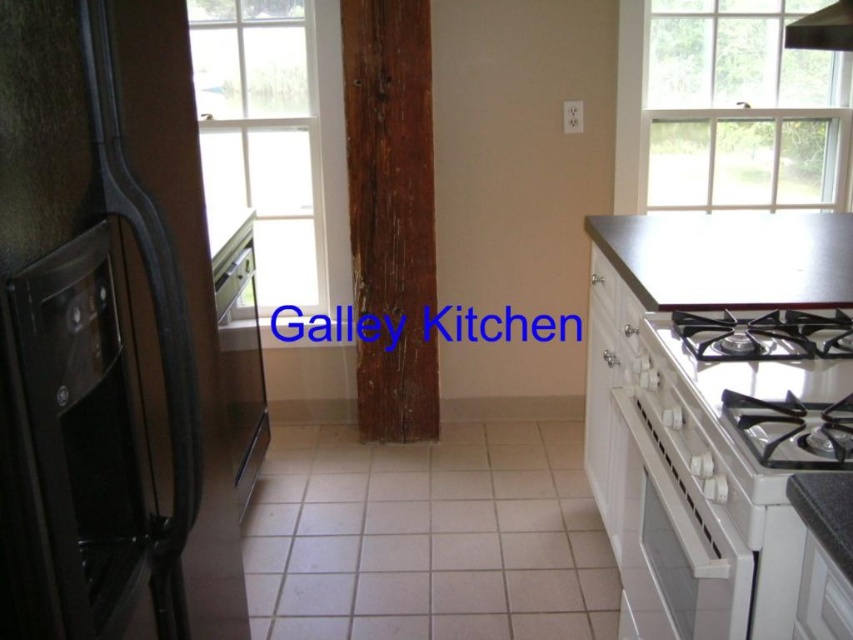
Is clear glass window at upper center smaller than white glossy oven at right?

Incorrect, clear glass window at upper center is not smaller in size than white glossy oven at right.

Measure the distance between clear glass window at upper center and camera.

clear glass window at upper center is 2.67 meters from camera.

At what (x,y) coordinates should I click in order to perform the action: click on clear glass window at upper center. Please return your answer as a coordinate pair (x, y). Looking at the image, I should click on (264, 136).

From the picture: Which of these two, metallic gray countertop at upper right or white glossy gas stove at right, stands shorter?

white glossy gas stove at right

Is the position of metallic gray countertop at upper right less distant than that of white glossy gas stove at right?

No, metallic gray countertop at upper right is further to the viewer.

Measure the distance between metallic gray countertop at upper right and camera.

A distance of 5.23 feet exists between metallic gray countertop at upper right and camera.

Image resolution: width=853 pixels, height=640 pixels. Find the location of `metallic gray countertop at upper right`. metallic gray countertop at upper right is located at coordinates (730, 259).

Can you confirm if satin silver refrigerator at left is thinner than smooth gray countertop at right?

No.

Between satin silver refrigerator at left and smooth gray countertop at right, which one is positioned lower?

smooth gray countertop at right

Where is `satin silver refrigerator at left`? Image resolution: width=853 pixels, height=640 pixels. satin silver refrigerator at left is located at coordinates (239, 344).